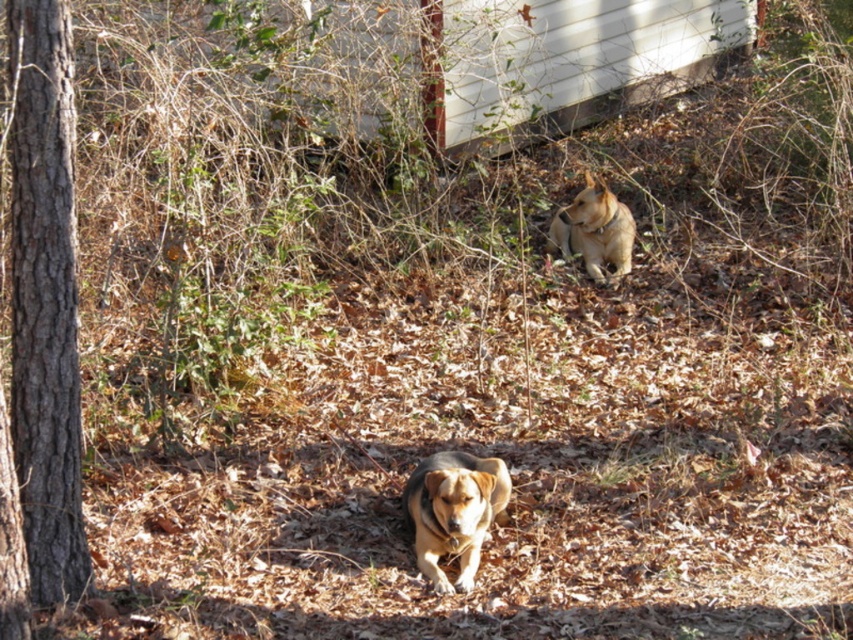
You are a photographer trying to capture both the brown rough bark tree at left and the brown fur dog at center in your shot. Which object is narrower so that it doesn

The brown rough bark tree at left is narrower than the brown fur dog at center, so it occupies less space in the frame.

You are standing in the wooded area and want to walk from the brown rough bark tree at left to the brown fur dog at upper center. Which direction should you move relative to the tree?

You should move to the right relative to the brown rough bark tree at left to reach the brown fur dog at upper center because the tree is positioned to the left of the dog.

You are standing in the wooded area and want to take a photo of the brown fur dog at upper center without the brown rough bark tree at left blocking the view. Is this possible based on their positions?

The brown rough bark tree at left is closer to the viewer than the brown fur dog at upper center, so the tree would block the view of the dog. Therefore, it is not possible to take a photo of the brown fur dog at upper center without the tree blocking the view.